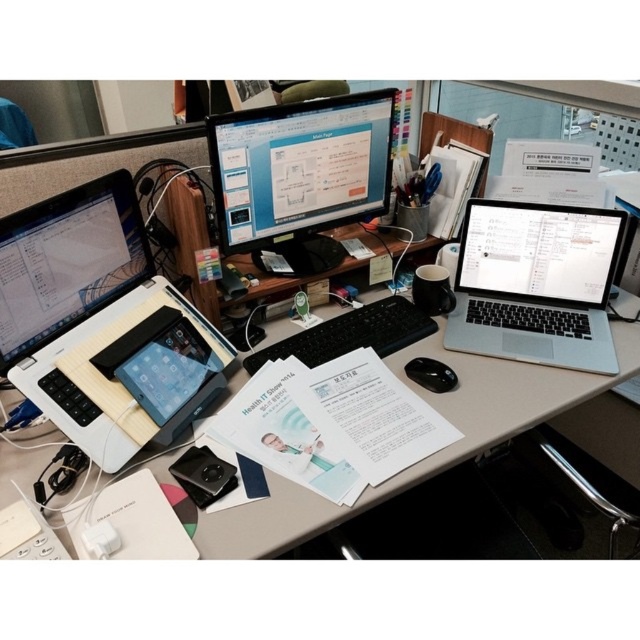
Where is the white matte laptop at left located in the image?

The white matte laptop at left is located at point (x=100, y=324).

You are organizing your desk and need to place a new monitor that requires 15 cm of vertical space. Given the white matte laptop at left and black matte mouse at center, which object might not have enough vertical space if placed above it?

The black matte mouse at center might not have enough vertical space if placed above it because the white matte laptop at left is much taller, which could block the required vertical space.

You are a photographer standing in front of a desk with a white matte laptop at left. You want to take a photo that includes the laptop and ensure it is in focus. Considering your camera has a depth of field range of 35 inches, will the laptop be in focus?

The white matte laptop at left is 35.51 inches from the camera. Since the depth of field range is 35 inches, the laptop is slightly out of the focus range. Therefore, it may not be in focus in the photo.